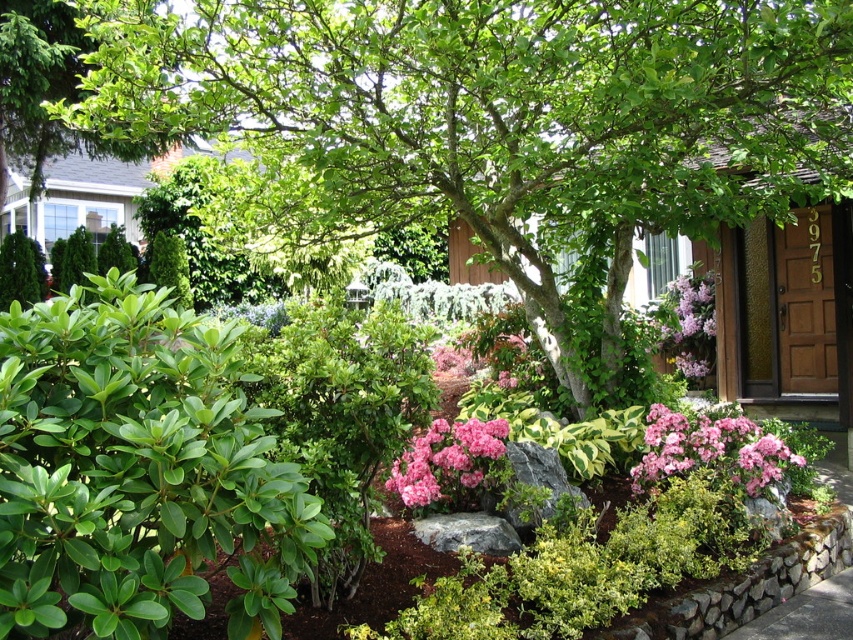
Looking at this image, can you confirm if green glossy shrub at lower left is positioned below pink matte flower at center?

No.

Which is behind, point (132, 337) or point (469, 470)?

The point (469, 470) is behind.

Is point (230, 460) less distant than point (428, 435)?

Yes.

Identify the location of green glossy shrub at lower left. This screenshot has width=853, height=640. (137, 470).

Measure the distance between point [311,0] and camera.

A distance of 4.17 meters exists between point [311,0] and camera.

The width and height of the screenshot is (853, 640). In order to click on green leafy tree at center in this screenshot , I will do coord(492,125).

What are the coordinates of `green leafy tree at center` in the screenshot? It's located at (492, 125).

Does green leafy tree at center appear over green glossy shrub at lower left?

Indeed, green leafy tree at center is positioned over green glossy shrub at lower left.

What do you see at coordinates (492, 125) in the screenshot? I see `green leafy tree at center` at bounding box center [492, 125].

Who is more distant from viewer, (659, 170) or (62, 499)?

The point (659, 170) is more distant.

Find the location of `green leafy tree at center`. green leafy tree at center is located at coordinates [x=492, y=125].